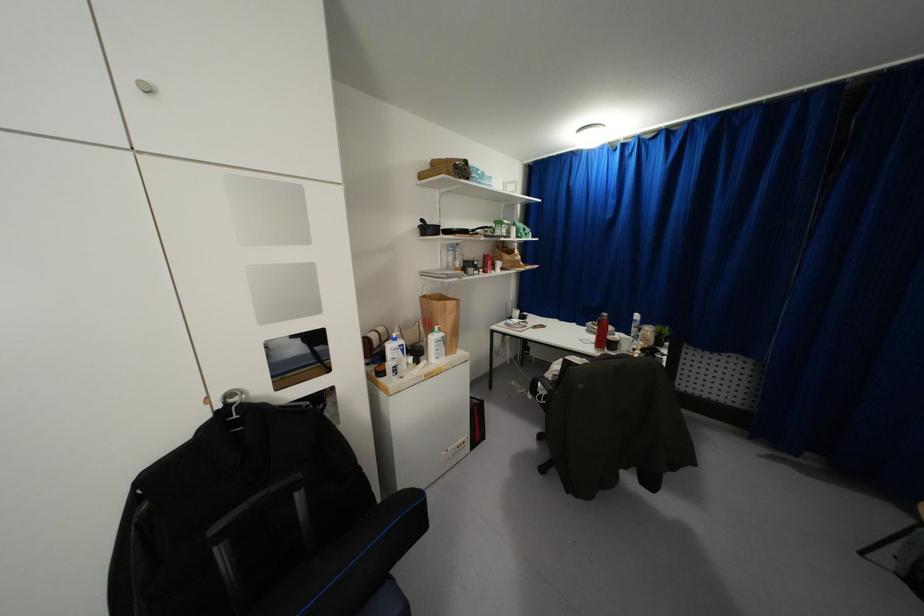
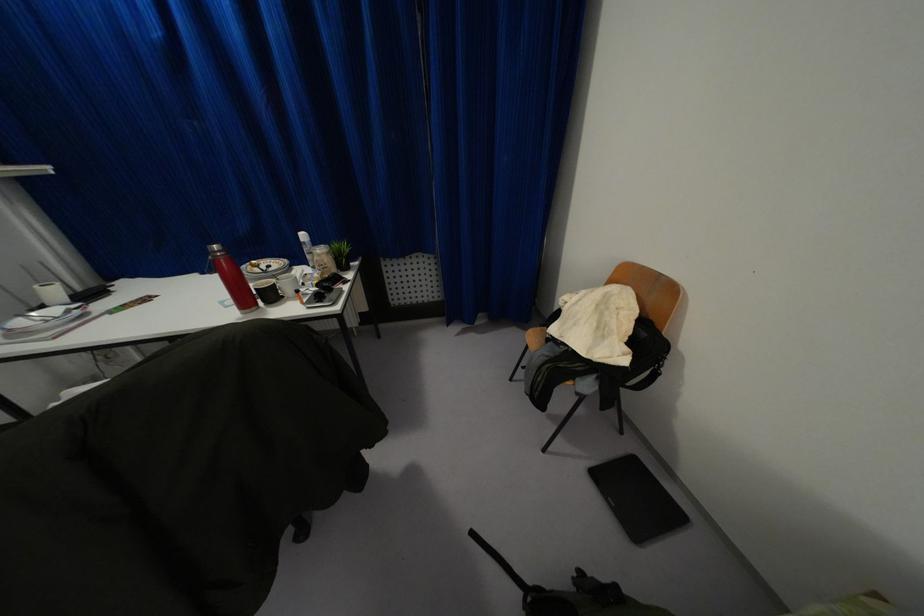
Find the pixel in the second image that matches (x=603, y=314) in the first image.

(214, 246)